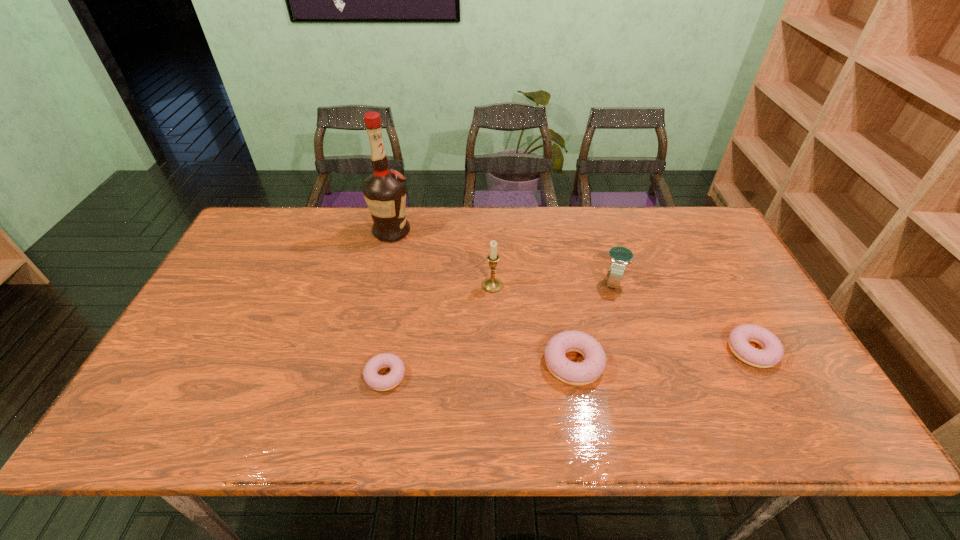
This screenshot has width=960, height=540. Find the location of `free space for a new doughnut on the left`. free space for a new doughnut on the left is located at coordinates (188, 389).